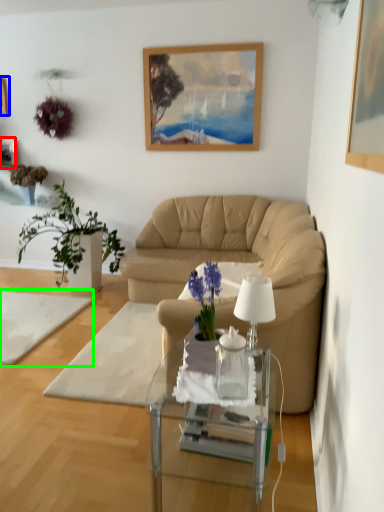
Question: Which is farther away from picture frame (highlighted by a red box)? picture frame (highlighted by a blue box) or plain (highlighted by a green box)?

Choices:
 (A) picture frame
 (B) plain

Answer: (B)